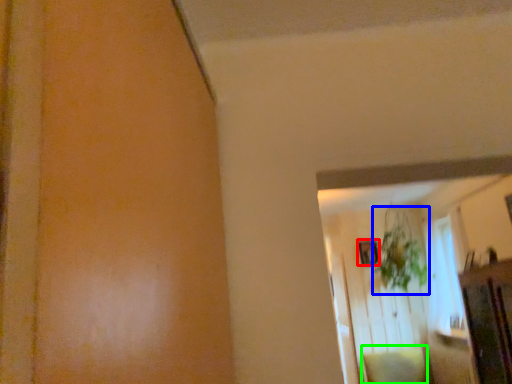
Question: Which object is the farthest from picture frame (highlighted by a red box)? Choose among these: plant (highlighted by a blue box) or pillow (highlighted by a green box).

Choices:
 (A) plant
 (B) pillow

Answer: (B)